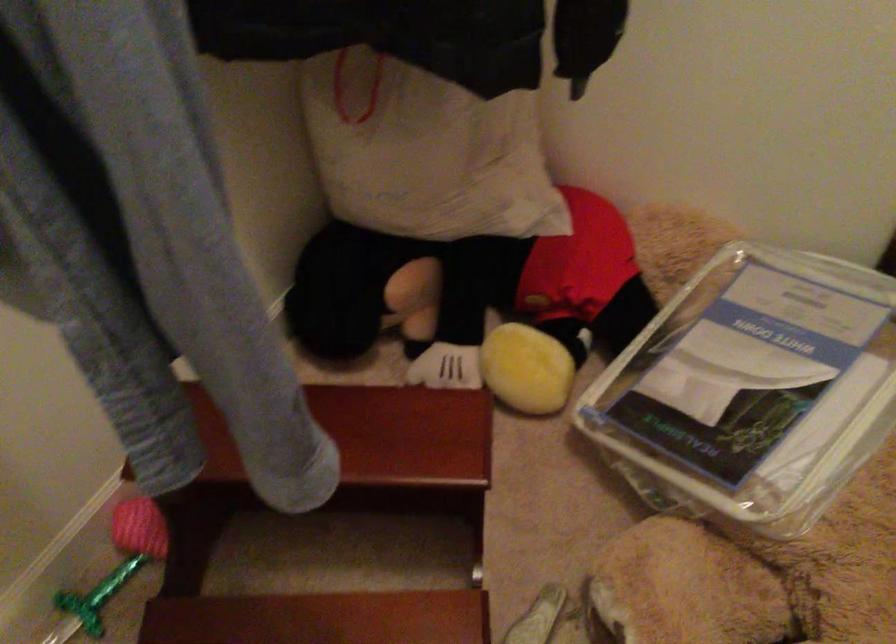
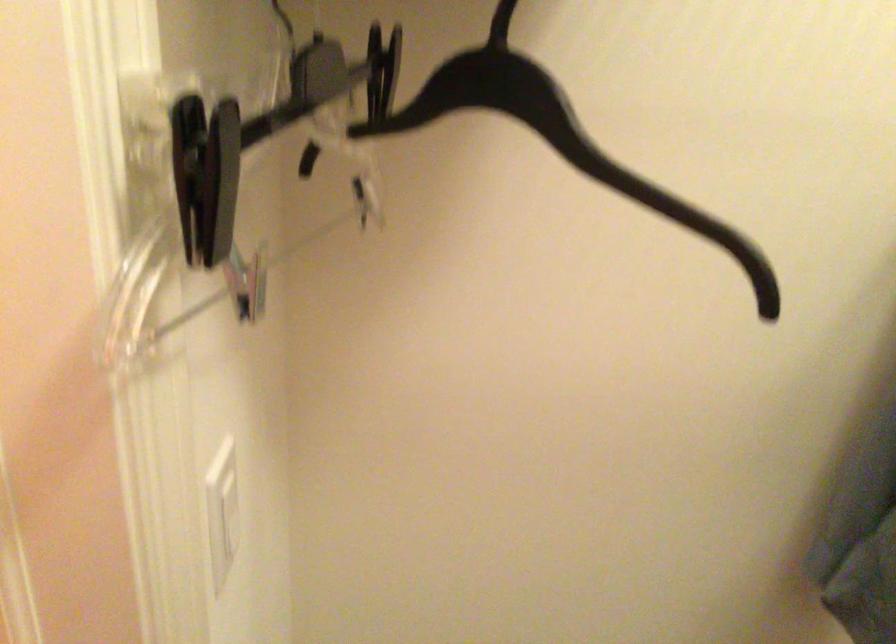
Question: How did the camera likely rotate?

Choices:
 (A) Left
 (B) Right
 (C) Up
 (D) Down

Answer: (A)